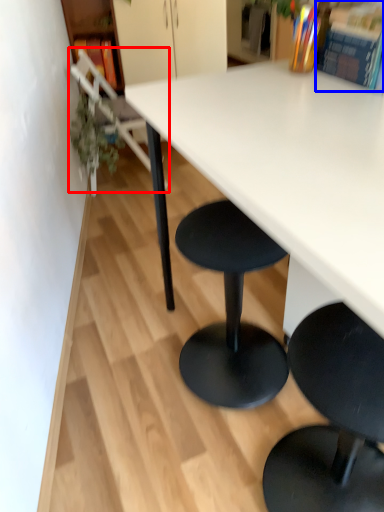
Question: Which of the following is the closest to the observer, chair (highlighted by a red box) or book (highlighted by a blue box)?

Choices:
 (A) chair
 (B) book

Answer: (B)